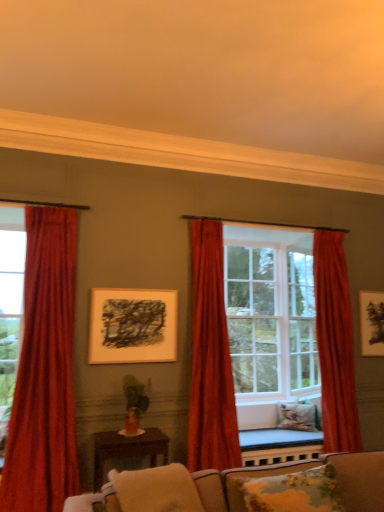
Image resolution: width=384 pixels, height=512 pixels. What do you see at coordinates (10, 307) in the screenshot? I see `transparent glass door at left, placed as the second glass door when sorted from right to left` at bounding box center [10, 307].

The image size is (384, 512). Describe the element at coordinates (210, 358) in the screenshot. I see `velvet red curtain at center, which is counted as the second curtain, starting from the left` at that location.

Measure the distance between point (x=359, y=444) and camera.

The distance of point (x=359, y=444) from camera is 14.54 feet.

This screenshot has height=512, width=384. Describe the element at coordinates (294, 492) in the screenshot. I see `fluffy floral pillow at lower right, acting as the second pillow starting from the back` at that location.

In order to face fluffy floral pillow at lower right, acting as the second pillow starting from the back, should I rotate leftwards or rightwards?

You should look right and rotate roughly 14.344 degrees.

At what (x,y) coordinates should I click in order to perform the action: click on velvet beige couch at lower center. Please return your answer as a coordinate pair (x, y). Looking at the image, I should click on pyautogui.click(x=298, y=471).

Find the location of `matte black picture frame at upper right, which ranks as the second picture frame in left-to-right order`. matte black picture frame at upper right, which ranks as the second picture frame in left-to-right order is located at coordinates (372, 323).

What do you see at coordinates (302, 322) in the screenshot? Image resolution: width=384 pixels, height=512 pixels. I see `clear glass door at center, arranged as the second glass door when viewed from the left` at bounding box center [302, 322].

Image resolution: width=384 pixels, height=512 pixels. Find the location of `transparent glass door at left, arranged as the 1th glass door when viewed from the left`. transparent glass door at left, arranged as the 1th glass door when viewed from the left is located at coordinates (10, 307).

Is velvet beige couch at lower center looking in the opposite direction of transparent glass door at left, arranged as the 1th glass door when viewed from the left?

That's not correct — velvet beige couch at lower center is not looking away from transparent glass door at left, arranged as the 1th glass door when viewed from the left.

Which is closer, (94, 503) or (8, 422)?

Clearly, point (94, 503) is closer to the camera than point (8, 422).

Find the location of `the 2nd glass door above the velvet beige couch at lower center (from the image's perspective)`. the 2nd glass door above the velvet beige couch at lower center (from the image's perspective) is located at coordinates (10, 307).

Looking at this image, considering the sizes of objects velvet beige couch at lower center and transparent glass door at left, the second glass door from the back, in the image provided, who is bigger, velvet beige couch at lower center or transparent glass door at left, the second glass door from the back,?

velvet beige couch at lower center.

From the image's perspective, which object appears higher, matte black picture frame at center, which is the 2th picture frame in right-to-left order, or velvet red curtain at left, which is the 3th curtain from right to left?

From the image's view, matte black picture frame at center, which is the 2th picture frame in right-to-left order, is above.

Is the depth of matte black picture frame at center, marked as the 2th picture frame in a back-to-front arrangement, less than that of velvet red curtain at left, the first curtain positioned from the left?

That is False.

Would you consider matte black picture frame at center, marked as the 2th picture frame in a back-to-front arrangement, to be distant from velvet red curtain at left, which is the 3th curtain from right to left?

They are positioned close to each other.

Could you tell me if fluffy beige pillow at lower center, which ranks as the third pillow in back-to-front order, is facing velvet red curtain at center, which is counted as the second curtain, starting from the left?

No, fluffy beige pillow at lower center, which ranks as the third pillow in back-to-front order, is not aimed at velvet red curtain at center, which is counted as the second curtain, starting from the left.

Considering the positions of objects fluffy beige pillow at lower center, acting as the first pillow starting from the left, and velvet red curtain at center, positioned as the second curtain in right-to-left order, in the image provided, who is more to the right, fluffy beige pillow at lower center, acting as the first pillow starting from the left, or velvet red curtain at center, positioned as the second curtain in right-to-left order,?

Positioned to the right is velvet red curtain at center, positioned as the second curtain in right-to-left order.

Consider the image. From a real-world perspective, is fluffy beige pillow at lower center, positioned as the first pillow in front-to-back order, below velvet red curtain at center, which is counted as the second curtain, starting from the left?

Yes, from a real-world perspective, fluffy beige pillow at lower center, positioned as the first pillow in front-to-back order, is below velvet red curtain at center, which is counted as the second curtain, starting from the left.

Between fluffy beige pillow at lower center, marked as the third pillow in a right-to-left arrangement, and velvet red curtain at center, positioned as the second curtain in right-to-left order, which one has larger size?

With larger size is velvet red curtain at center, positioned as the second curtain in right-to-left order.

In terms of width, does velvet beige couch at lower center look wider or thinner when compared to matte black picture frame at center, which is the 2th picture frame in right-to-left order?

velvet beige couch at lower center is wider than matte black picture frame at center, which is the 2th picture frame in right-to-left order.

This screenshot has width=384, height=512. I want to click on picture frame that is the 1st object located behind the velvet beige couch at lower center, so click(132, 326).

Can you tell me how much velvet beige couch at lower center and matte black picture frame at center, which is the first picture frame from left to right, differ in facing direction?

velvet beige couch at lower center and matte black picture frame at center, which is the first picture frame from left to right, are facing 0.208 degrees away from each other.

Can you confirm if fluffy beige pillow at lower center, acting as the first pillow starting from the left, is wider than velvet red curtain at right, the 3th curtain in the left-to-right sequence?

Indeed, fluffy beige pillow at lower center, acting as the first pillow starting from the left, has a greater width compared to velvet red curtain at right, the 3th curtain in the left-to-right sequence.

Considering the relative sizes of fluffy beige pillow at lower center, acting as the first pillow starting from the left, and velvet red curtain at right, the 3th curtain in the left-to-right sequence, in the image provided, is fluffy beige pillow at lower center, acting as the first pillow starting from the left, smaller than velvet red curtain at right, the 3th curtain in the left-to-right sequence,?

Correct, fluffy beige pillow at lower center, acting as the first pillow starting from the left, occupies less space than velvet red curtain at right, the 3th curtain in the left-to-right sequence.

Is fluffy beige pillow at lower center, acting as the first pillow starting from the left, oriented towards velvet red curtain at right, the 3th curtain in the left-to-right sequence?

No, fluffy beige pillow at lower center, acting as the first pillow starting from the left, is not turned towards velvet red curtain at right, the 3th curtain in the left-to-right sequence.

Does matte black picture frame at upper right, the 2th picture frame viewed from the front, touch velvet beige couch at lower center?

No, matte black picture frame at upper right, the 2th picture frame viewed from the front, is not beside velvet beige couch at lower center.

From a real-world perspective, starting from the velvet beige couch at lower center, which picture frame is the 2nd one vertically above it? Please provide its 2D coordinates.

[(372, 323)]

Can you tell me how much matte black picture frame at upper right, which appears as the first picture frame when viewed from the right, and velvet beige couch at lower center differ in facing direction?

The angle between the facing direction of matte black picture frame at upper right, which appears as the first picture frame when viewed from the right, and the facing direction of velvet beige couch at lower center is 0.145 degrees.

How distant is matte black picture frame at upper right, which ranks as the second picture frame in left-to-right order, from velvet beige couch at lower center?

matte black picture frame at upper right, which ranks as the second picture frame in left-to-right order, is 1.88 meters from velvet beige couch at lower center.

Locate an element on the screen. The width and height of the screenshot is (384, 512). the 1st glass door located above the velvet red curtain at center, positioned as the second curtain in right-to-left order (from a real-world perspective) is located at coordinates (10, 307).

Considering the relative sizes of transparent glass door at left, the second glass door from the back, and velvet red curtain at center, which is counted as the second curtain, starting from the left, in the image provided, is transparent glass door at left, the second glass door from the back, bigger than velvet red curtain at center, which is counted as the second curtain, starting from the left,?

Yes.

From a real-world perspective, is transparent glass door at left, arranged as the 1th glass door when viewed from the left, below velvet red curtain at center, positioned as the second curtain in right-to-left order?

Incorrect, from a real-world perspective, transparent glass door at left, arranged as the 1th glass door when viewed from the left, is higher than velvet red curtain at center, positioned as the second curtain in right-to-left order.

Is transparent glass door at left, which appears as the 1th glass door when viewed from the front, in front of velvet red curtain at center, which is counted as the second curtain, starting from the left?

Yes, it is in front of velvet red curtain at center, which is counted as the second curtain, starting from the left.

Identify the location of the 2nd glass door above when counting from the velvet beige couch at lower center (from the image's perspective). The image size is (384, 512). (10, 307).

You are a GUI agent. You are given a task and a screenshot of the screen. Output one action in this format:
    pyautogui.click(x=<x>, y=<y>)
    Task: Click on the curtain that is on the left side of matte black picture frame at center, which is the 2th picture frame in right-to-left order
    
    Given the screenshot: What is the action you would take?
    pyautogui.click(x=44, y=371)

Looking at the image, which one is located closer to velvet beige couch at lower center, clear glass window at center or brown wooden table at center?

The object closer to velvet beige couch at lower center is brown wooden table at center.

From the picture: Estimate the real-world distances between objects in this image. Which object is closer to velvet red curtain at center, which is counted as the second curtain, starting from the left, clear glass window at center or velvet red curtain at left, the first curtain positioned from the left?

clear glass window at center lies closer to velvet red curtain at center, which is counted as the second curtain, starting from the left, than the other object.

Consider the image. Which object lies further to the anchor point velvet red curtain at center, positioned as the second curtain in right-to-left order, velvet beige couch at lower center or velvet red curtain at left, which is the 3th curtain from right to left?

velvet beige couch at lower center is further to velvet red curtain at center, positioned as the second curtain in right-to-left order.

Considering their positions, is matte black picture frame at center, the 1th picture frame in the front-to-back sequence, positioned further to fluffy white pillow at lower right, which appears as the third pillow when viewed from the left, than transparent glass door at left, placed as the second glass door when sorted from right to left?

transparent glass door at left, placed as the second glass door when sorted from right to left, is positioned further to the anchor fluffy white pillow at lower right, which appears as the third pillow when viewed from the left.

When comparing their distances from clear glass door at center, marked as the second glass door in a front-to-back arrangement, does velvet red curtain at center, which is counted as the second curtain, starting from the left, or fluffy floral pillow at lower right, acting as the second pillow starting from the back, seem further?

fluffy floral pillow at lower right, acting as the second pillow starting from the back, is positioned further to the anchor clear glass door at center, marked as the second glass door in a front-to-back arrangement.

Looking at the image, which one is located closer to transparent glass door at left, which appears as the 1th glass door when viewed from the front, brown wooden table at center or matte black picture frame at center, the 1th picture frame in the front-to-back sequence?

The object closer to transparent glass door at left, which appears as the 1th glass door when viewed from the front, is brown wooden table at center.

Looking at this image, when comparing their distances from clear glass window at center, does fluffy beige pillow at lower center, marked as the third pillow in a right-to-left arrangement, or matte black picture frame at center, which is the first picture frame from left to right, seem closer?

The object closer to clear glass window at center is matte black picture frame at center, which is the first picture frame from left to right.

Which object lies nearer to the anchor point velvet red curtain at left, which is the 3th curtain from right to left, brown wooden table at center or fluffy beige pillow at lower center, positioned as the first pillow in front-to-back order?

brown wooden table at center lies closer to velvet red curtain at left, which is the 3th curtain from right to left, than the other object.

I want to click on table between matte black picture frame at center, which is the first picture frame from left to right, and clear glass window at center, in the horizontal direction, so pos(127,449).

Identify the location of pillow located between fluffy beige pillow at lower center, acting as the first pillow starting from the left, and fluffy white pillow at lower right, placed as the first pillow when sorted from right to left, in the depth direction. The width and height of the screenshot is (384, 512). (294, 492).

At what (x,y) coordinates should I click in order to perform the action: click on window situated between brown wooden table at center and velvet red curtain at right, the 3th curtain in the left-to-right sequence, from left to right. Please return your answer as a coordinate pair (x, y). This screenshot has width=384, height=512. Looking at the image, I should click on tap(271, 314).

Find the location of a particular element. This screenshot has height=512, width=384. glass door located between velvet beige couch at lower center and clear glass window at center in the depth direction is located at coordinates (10, 307).